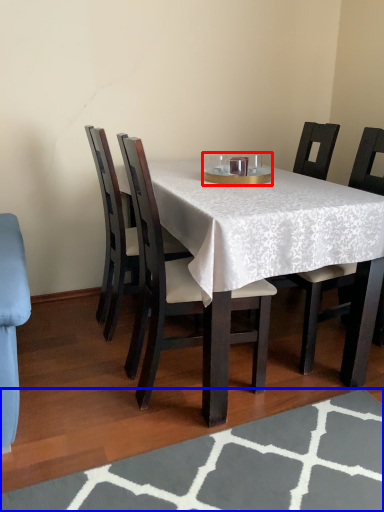
Question: Which of the following is the farthest to the observer, tableware (highlighted by a red box) or place mat (highlighted by a blue box)?

Choices:
 (A) tableware
 (B) place mat

Answer: (A)